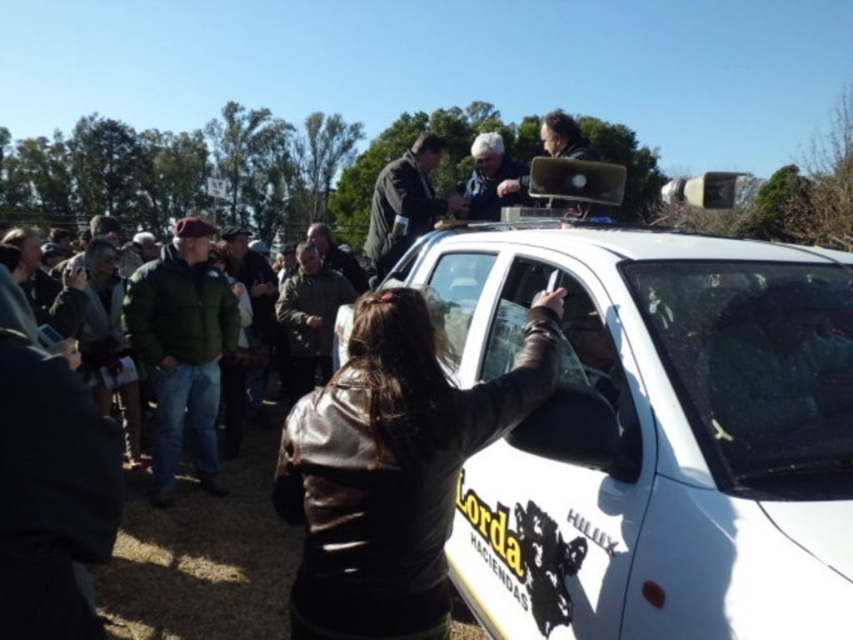
You are a photographer setting up equipment for an event. You have a matte black laptop at upper center and a dark brown leather jacket at center. Which object is wider in the scene?

The dark brown leather jacket at center might be wider than the matte black laptop at upper center.

You are organizing a photo shoot and need to ensure that two jackets, the leather jacket at center and the green fuzzy jacket at lower left, are placed in a way that the wider jacket is positioned closer to the camera. Based on the scene description, which jacket should be placed where?

The leather jacket at center is wider than the green fuzzy jacket at lower left. Therefore, the leather jacket at center should be placed closer to the camera to ensure it appears appropriately sized in the photo.

You are a photographer standing at the white matte car at center and want to capture a photo of the green fuzzy jacket at left without moving the jacket. What is the minimum distance you need to move backward to ensure both the car and the jacket are in frame?

The white matte car at center and green fuzzy jacket at left are 10.72 feet apart. To include both in the frame, you need to move back at least 10.72 feet so that the distance between them fits within the camera view.